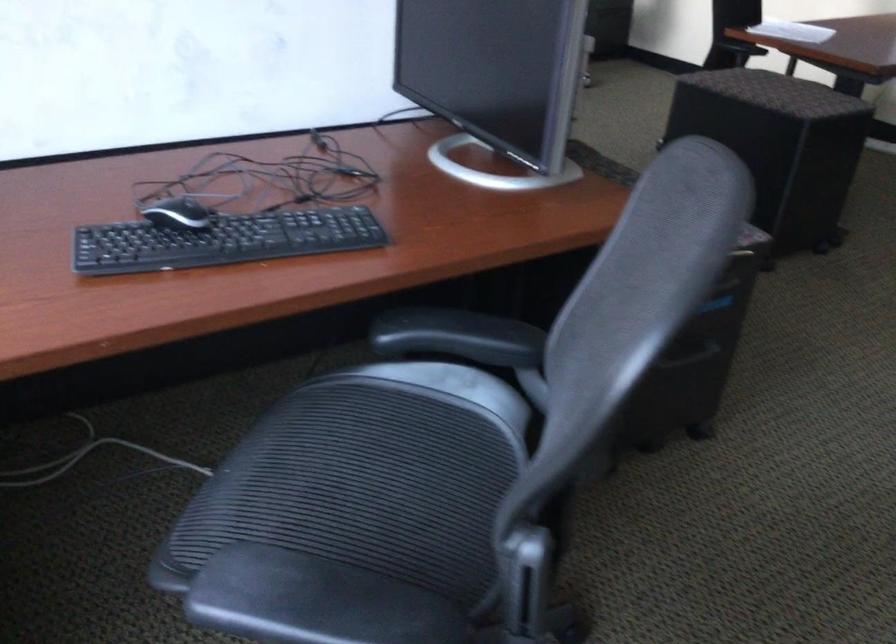
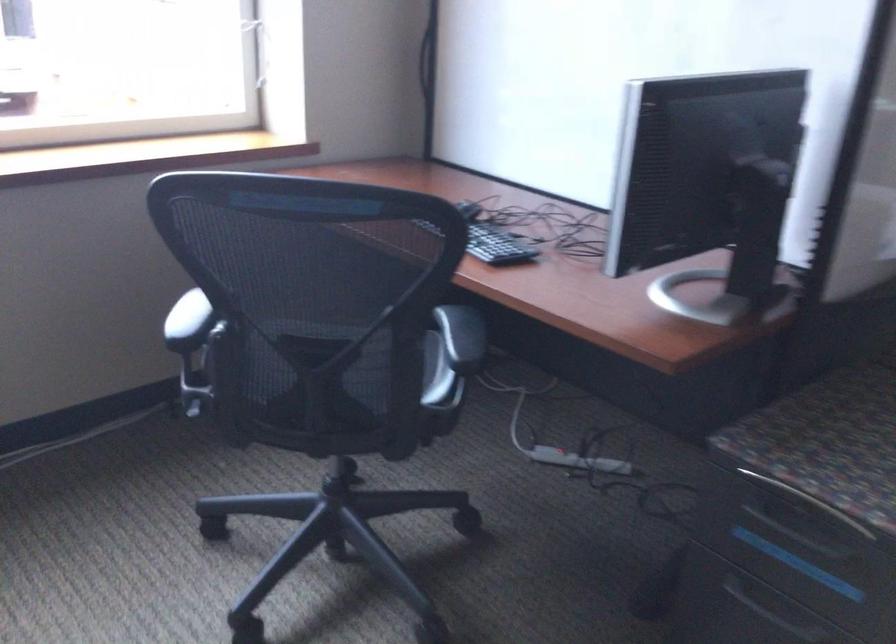
Locate, in the second image, the point that corresponds to pixel 511 330 in the first image.

(461, 337)